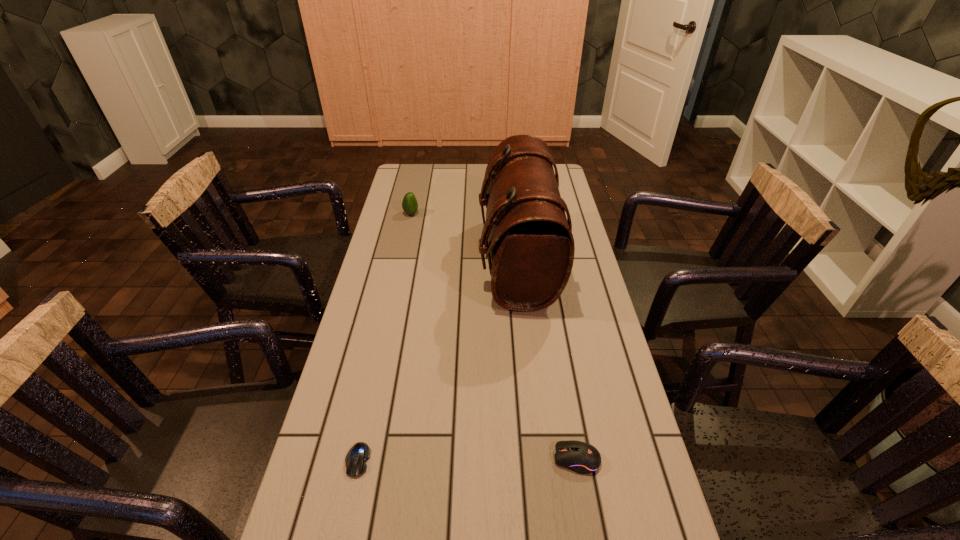
Identify the location of the third nearest object. (531, 244).

Image resolution: width=960 pixels, height=540 pixels. What are the coordinates of `the tallest object` in the screenshot? It's located at (531, 244).

The width and height of the screenshot is (960, 540). In order to click on the third shortest object in this screenshot , I will do `click(409, 204)`.

Where is `the farthest object`? Image resolution: width=960 pixels, height=540 pixels. the farthest object is located at coordinates (409, 204).

Where is `the taller computer mouse`? the taller computer mouse is located at coordinates (581, 457).

You are a GUI agent. You are given a task and a screenshot of the screen. Output one action in this format:
    pyautogui.click(x=<x>, y=<y>)
    Task: Click on the third tallest object
    The image size is (960, 540).
    Given the screenshot: What is the action you would take?
    pyautogui.click(x=581, y=457)

Where is `the shortest object`? The width and height of the screenshot is (960, 540). the shortest object is located at coordinates (356, 458).

Where is `the shorter computer mouse`? This screenshot has width=960, height=540. the shorter computer mouse is located at coordinates (356, 458).

At what (x,y) coordinates should I click in order to perform the action: click on vacant space situated 0.080m on the front-facing side of the satchel. Please return your answer as a coordinate pair (x, y). Looking at the image, I should click on (455, 261).

What are the coordinates of `free space located 0.220m on the front-facing side of the satchel` in the screenshot? It's located at (414, 261).